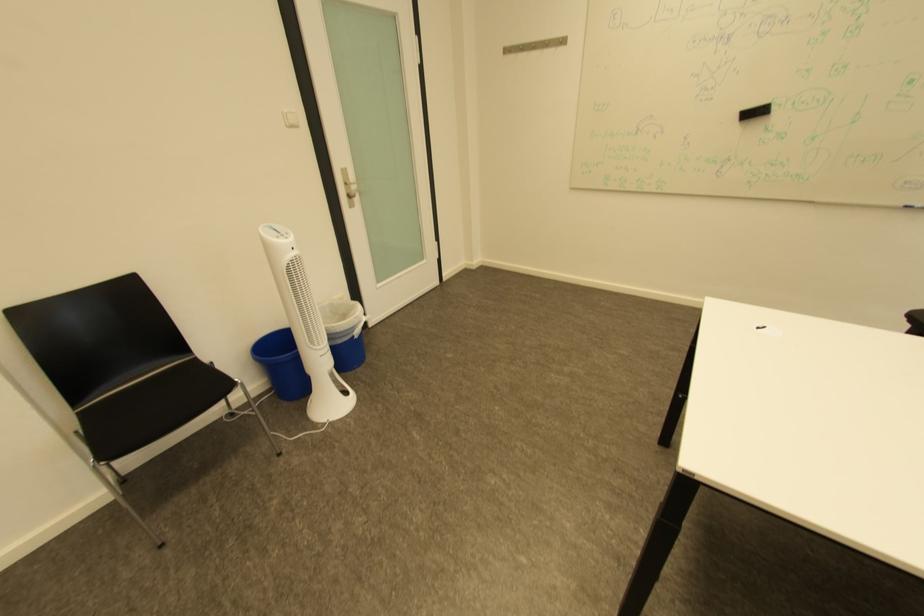
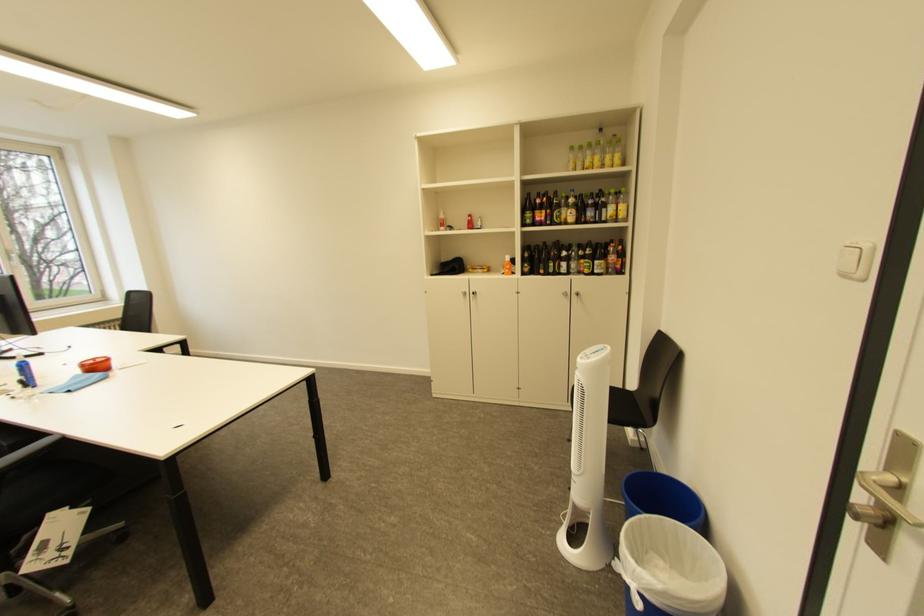
Locate, in the second image, the point that corresponds to the point at 370,323 in the first image.

(636, 570)